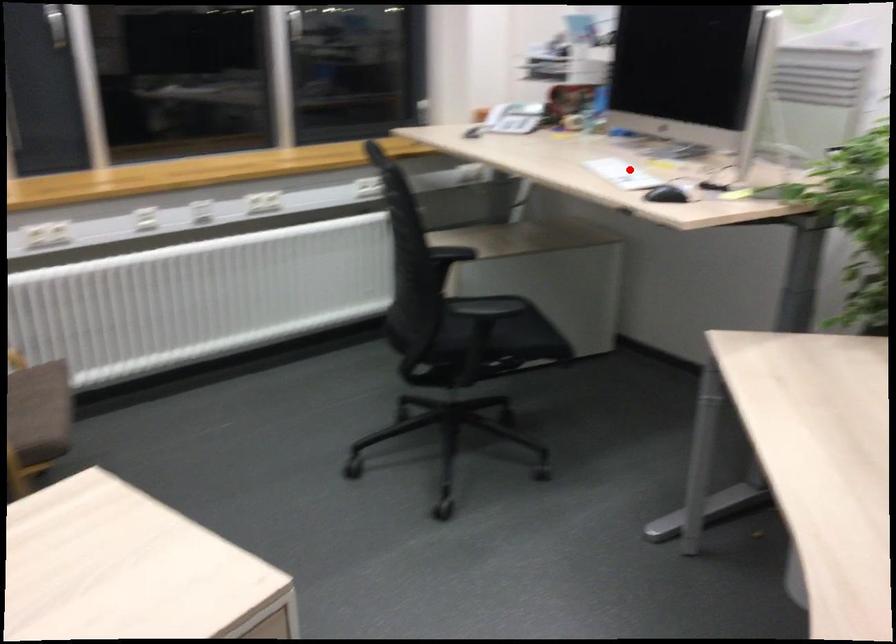
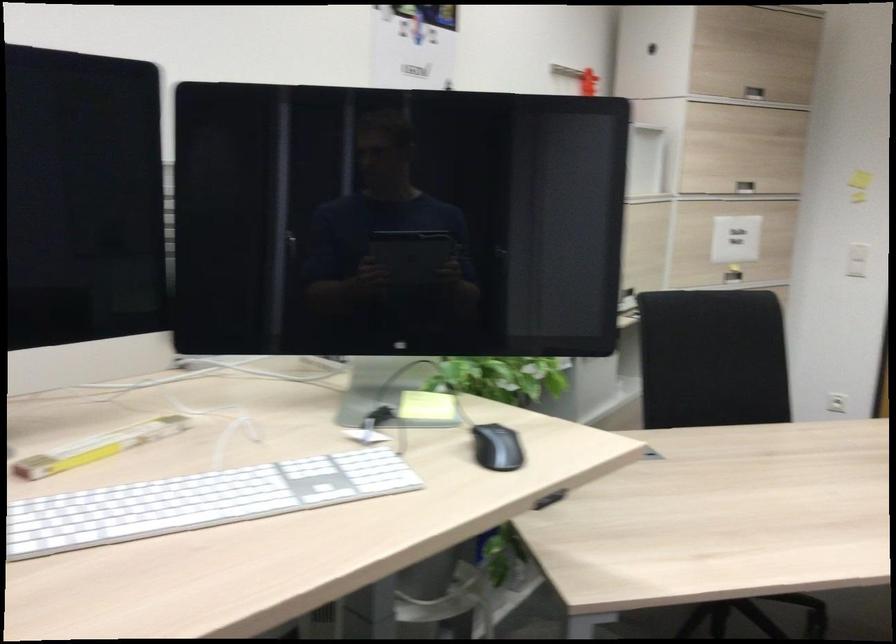
The point at the highlighted location is marked in the first image. Where is the corresponding point in the second image?

(200, 500)